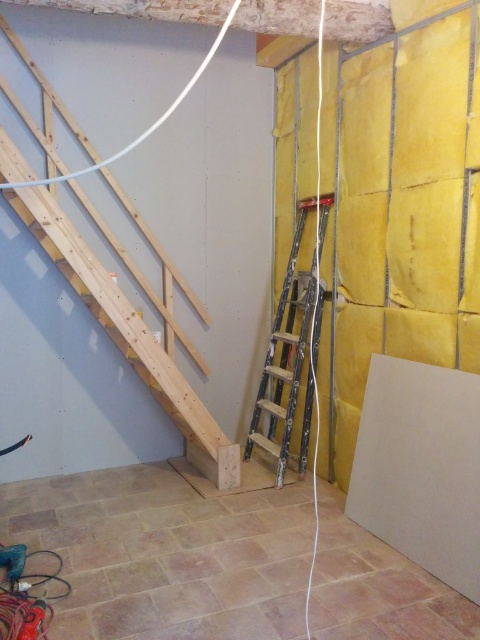
Which is behind, point (113, 608) or point (284, 456)?

Positioned behind is point (284, 456).

Can you confirm if beige tile floor at lower center is thinner than metallic silver ladder at center?

No, beige tile floor at lower center is not thinner than metallic silver ladder at center.

Is point (192, 602) farther from viewer compared to point (300, 454)?

No, (192, 602) is closer to viewer.

The image size is (480, 640). In order to click on beige tile floor at lower center in this screenshot , I will do `click(167, 554)`.

Is beige tile floor at lower center above natural wood stairs at left?

No.

Does beige tile floor at lower center appear on the left side of natural wood stairs at left?

Incorrect, beige tile floor at lower center is not on the left side of natural wood stairs at left.

Does point (300, 628) lie in front of point (0, 136)?

Yes.

Where is `beige tile floor at lower center`? Image resolution: width=480 pixels, height=640 pixels. beige tile floor at lower center is located at coordinates (167, 554).

Can you confirm if natural wood stairs at left is positioned to the left of metallic silver ladder at center?

Yes, natural wood stairs at left is to the left of metallic silver ladder at center.

The height and width of the screenshot is (640, 480). In order to click on natural wood stairs at left in this screenshot , I will do `click(130, 336)`.

At what (x,y) coordinates should I click in order to perform the action: click on natural wood stairs at left. Please return your answer as a coordinate pair (x, y). The width and height of the screenshot is (480, 640). Looking at the image, I should click on (130, 336).